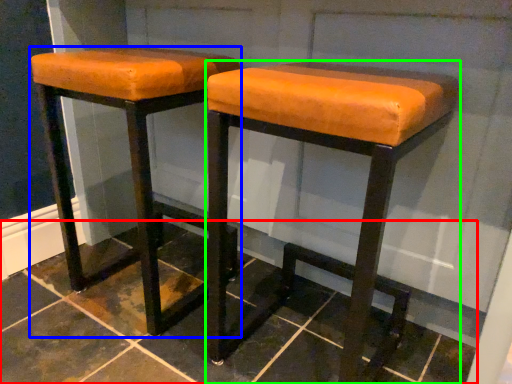
Question: Which object is positioned closest to tile (highlighted by a red box)? Select from stool (highlighted by a blue box) and stool (highlighted by a green box).

Choices:
 (A) stool
 (B) stool

Answer: (A)